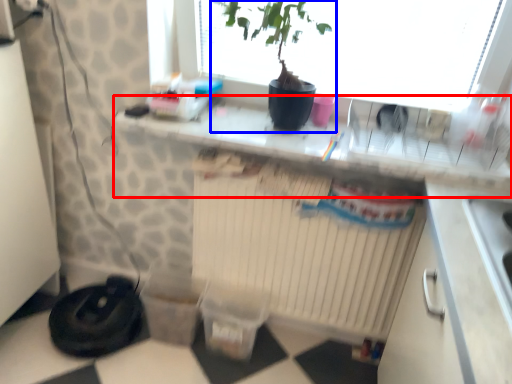
Question: Which object is closer to the camera taking this photo, counter top (highlighted by a red box) or houseplant (highlighted by a blue box)?

Choices:
 (A) counter top
 (B) houseplant

Answer: (B)